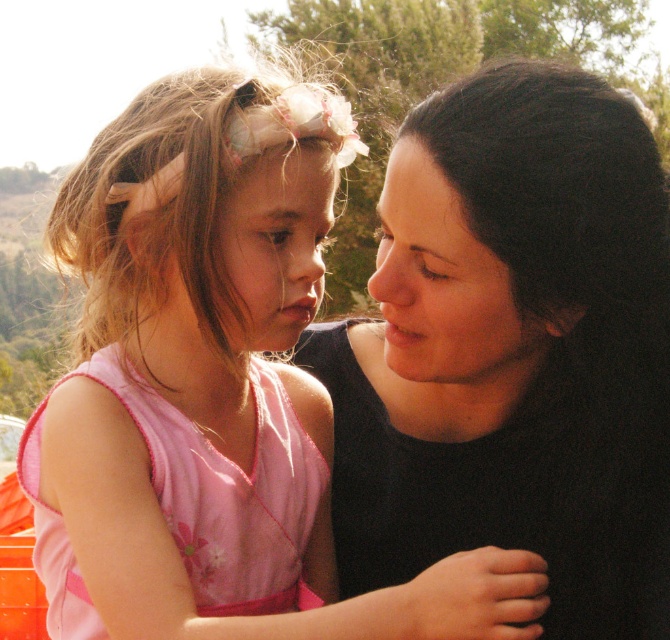
Question: Which object appears farthest from the camera in this image?

Choices:
 (A) black matte hair at upper right
 (B) pink satin dress at center

Answer: (A)

Question: Is pink satin dress at center positioned at the back of black matte hair at upper right?

Choices:
 (A) no
 (B) yes

Answer: (A)

Question: Is pink satin dress at center positioned at the back of black matte hair at upper right?

Choices:
 (A) no
 (B) yes

Answer: (A)

Question: In this image, where is pink satin dress at center located relative to black matte hair at upper right?

Choices:
 (A) above
 (B) below

Answer: (A)

Question: Which of the following is the closest to the observer?

Choices:
 (A) (616, 525)
 (B) (214, 202)

Answer: (B)

Question: Which point is farther from the camera taking this photo?

Choices:
 (A) (438, 161)
 (B) (139, 488)

Answer: (A)